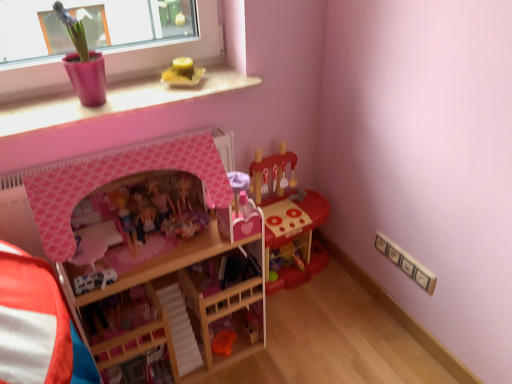
At what (x,y) coordinates should I click in order to perform the action: click on vacant area to the right of matte plastic play kitchen at center, marked as the 5th toy in a left-to-right arrangement. Please return your answer as a coordinate pair (x, y). The width and height of the screenshot is (512, 384). Looking at the image, I should click on (344, 295).